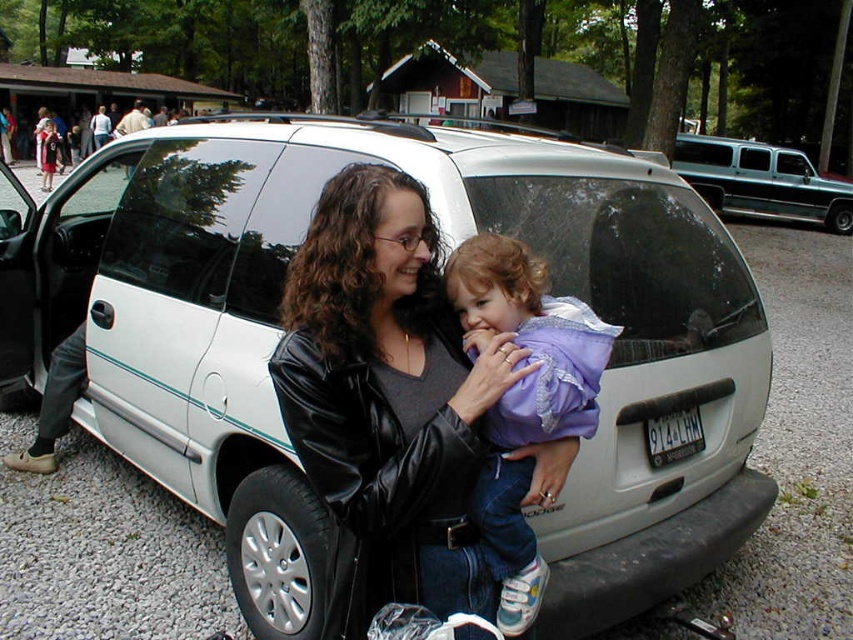
Can you confirm if purple fleece jacket at center is bigger than teal metallic van at right?

Actually, purple fleece jacket at center might be smaller than teal metallic van at right.

Can you confirm if purple fleece jacket at center is positioned below teal metallic van at right?

Yes.

Between point (567, 429) and point (776, 160), which one is positioned behind?

Positioned behind is point (776, 160).

Find the location of a particular element. purple fleece jacket at center is located at coordinates pyautogui.click(x=524, y=397).

Is black leather jacket at center to the right of teal metallic van at right from the viewer's perspective?

In fact, black leather jacket at center is to the left of teal metallic van at right.

Based on the photo, does black leather jacket at center have a larger size compared to teal metallic van at right?

Actually, black leather jacket at center might be smaller than teal metallic van at right.

Is point (463, 522) less distant than point (740, 196)?

Yes, point (463, 522) is in front of point (740, 196).

This screenshot has height=640, width=853. Identify the location of black leather jacket at center. (386, 401).

Which is behind, point (682, 554) or point (42, 131)?

Point (42, 131)

Who is taller, white matte van at center or matte black dress at center?

matte black dress at center

What do you see at coordinates (445, 246) in the screenshot? I see `white matte van at center` at bounding box center [445, 246].

Find the location of a particular element. Image resolution: width=853 pixels, height=640 pixels. white matte van at center is located at coordinates (445, 246).